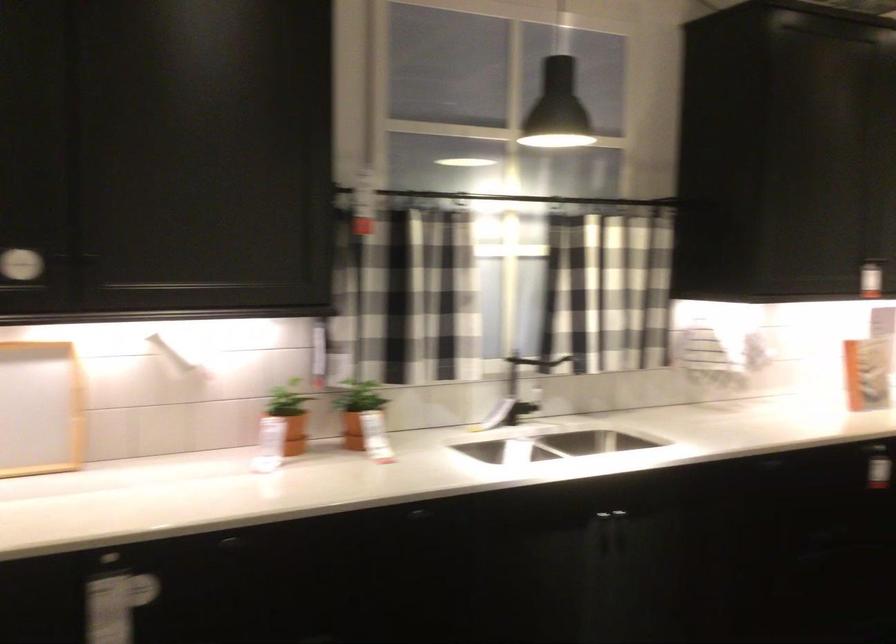
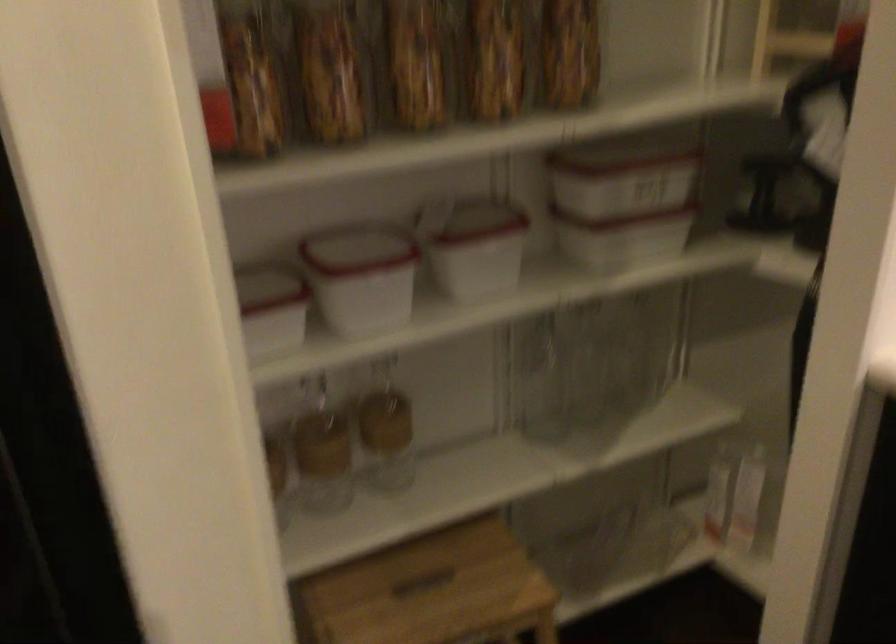
Based on the photo, how did the camera likely rotate?

The camera's rotation is toward left-down.